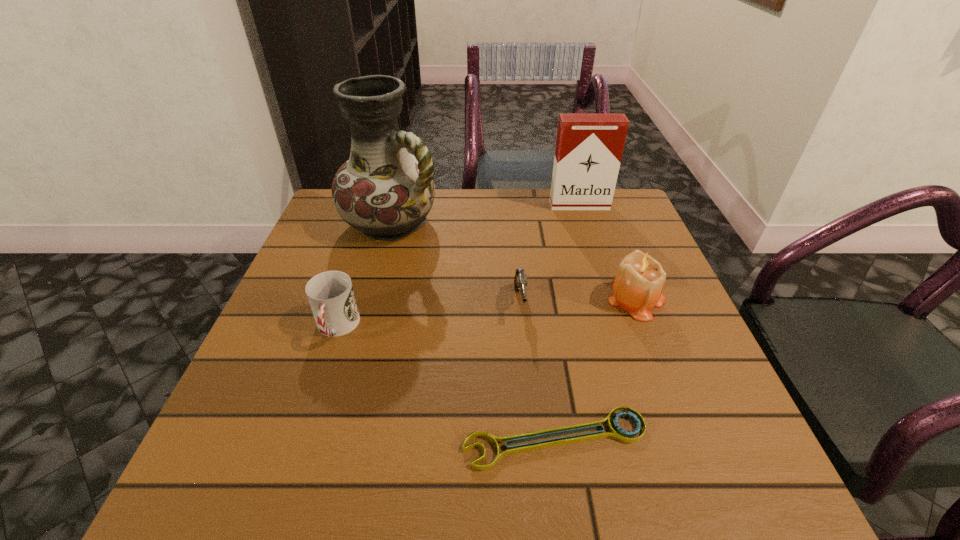
The height and width of the screenshot is (540, 960). What are the coordinates of `vacant area that lies between the fourth shortest object and the fifth tallest object` in the screenshot? It's located at (578, 301).

At what (x,y) coordinates should I click in order to perform the action: click on free spot between the nearest object and the tallest object. Please return your answer as a coordinate pair (x, y). This screenshot has width=960, height=540. Looking at the image, I should click on (473, 331).

Find the location of a particular element. vacant space in between the third tallest object and the tallest object is located at coordinates (514, 261).

Locate an element on the screen. The height and width of the screenshot is (540, 960). free space between the wrench and the cup is located at coordinates (446, 383).

You are a GUI agent. You are given a task and a screenshot of the screen. Output one action in this format:
    pyautogui.click(x=<x>, y=<y>)
    Task: Click on the free space between the cup and the pistol
    The image size is (960, 540).
    Given the screenshot: What is the action you would take?
    pyautogui.click(x=428, y=315)

Locate an element on the screen. This screenshot has width=960, height=540. unoccupied area between the fifth tallest object and the nearest object is located at coordinates (538, 371).

Image resolution: width=960 pixels, height=540 pixels. Find the location of `free spot between the fifth shortest object and the fourth tallest object`. free spot between the fifth shortest object and the fourth tallest object is located at coordinates (458, 266).

Locate an element on the screen. free spot between the third tallest object and the fourth tallest object is located at coordinates (487, 313).

The height and width of the screenshot is (540, 960). I want to click on free space between the cup and the fifth tallest object, so click(x=428, y=315).

Find the location of a particular element. The height and width of the screenshot is (540, 960). free point between the vase and the shortest object is located at coordinates (473, 331).